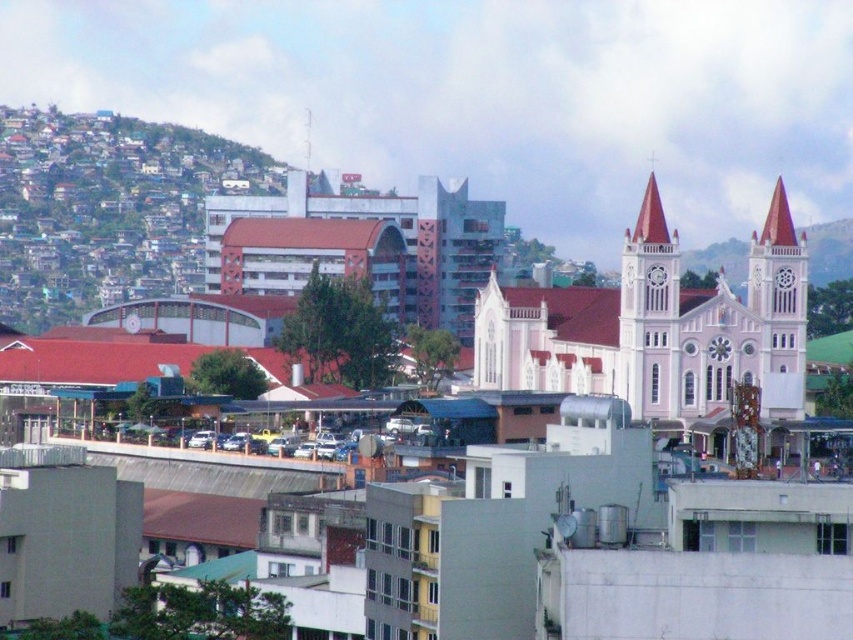
Which is below, matte red brick church at center or white stucco clock tower at upper right?

Positioned lower is white stucco clock tower at upper right.

Who is positioned more to the left, matte red brick church at center or white stucco clock tower at upper right?

Positioned to the left is matte red brick church at center.

The width and height of the screenshot is (853, 640). I want to click on matte red brick church at center, so click(399, 248).

The image size is (853, 640). What are the coordinates of `matte red brick church at center` in the screenshot? It's located at (399, 248).

Is white stucco church at center-right smaller than white stucco clock tower at upper right?

No.

Does point (724, 289) lie in front of point (782, 404)?

That is True.

Between point (508, 333) and point (776, 211), which one is positioned behind?

Positioned behind is point (508, 333).

Where is `white stucco church at center-right`? The height and width of the screenshot is (640, 853). white stucco church at center-right is located at coordinates (659, 328).

This screenshot has height=640, width=853. What do you see at coordinates (659, 328) in the screenshot?
I see `white stucco church at center-right` at bounding box center [659, 328].

Can you confirm if white stucco church at center-right is positioned to the left of white stucco church tower at center-right?

Yes, white stucco church at center-right is to the left of white stucco church tower at center-right.

Who is more forward, (503,323) or (640,230)?

Positioned in front is point (640,230).

Identify the location of white stucco church at center-right. The height and width of the screenshot is (640, 853). (659, 328).